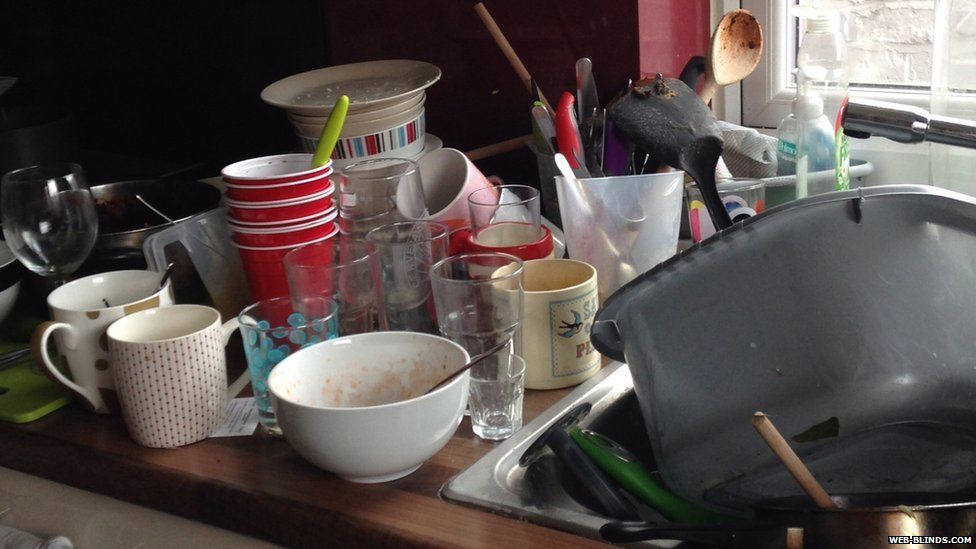
Locate an element on the screen. kitchen cabinet is located at coordinates pos(111,523), pos(581,33).